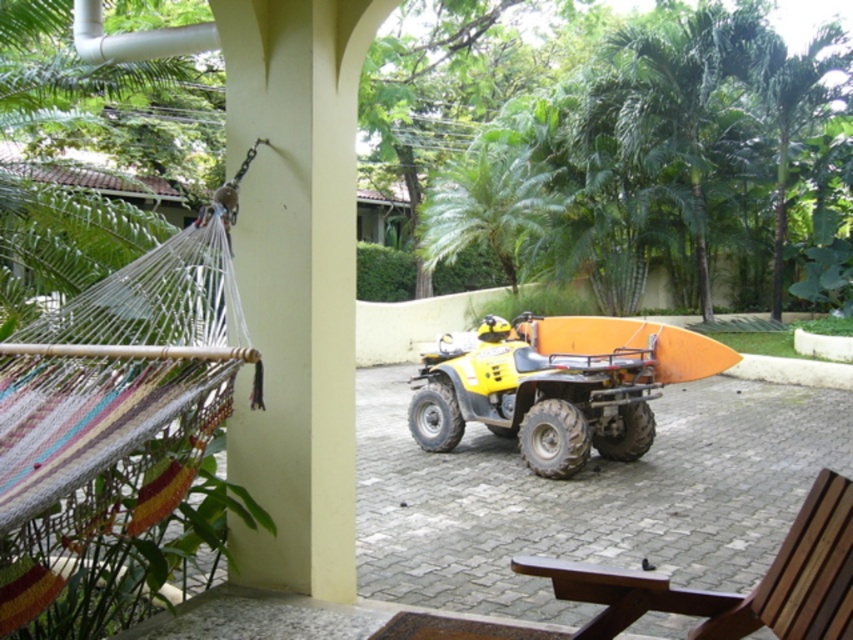
Does point (776, 556) come farther from viewer compared to point (666, 355)?

No, it is in front of (666, 355).

Who is positioned more to the right, brown wooden chair at lower right or orange matte surfboard at center?

orange matte surfboard at center is more to the right.

Where is `brown wooden chair at lower right`? This screenshot has width=853, height=640. brown wooden chair at lower right is located at coordinates (734, 593).